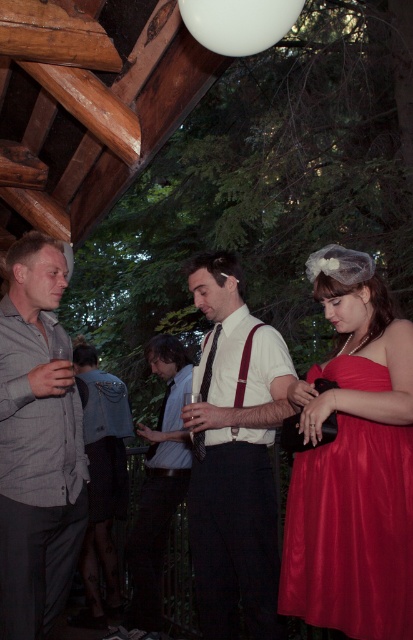
Question: Which of the following is the farthest from the observer?

Choices:
 (A) (11, 573)
 (B) (199, 253)
 (C) (121, 387)

Answer: (C)

Question: Which of the following is the farthest from the observer?

Choices:
 (A) (14, 333)
 (B) (394, 465)
 (C) (90, 625)
 (D) (163, 500)

Answer: (C)

Question: Among these objects, which one is nearest to the camera?

Choices:
 (A) denim jacket at center
 (B) matte red dress at center

Answer: (B)

Question: Is white matte shirt at center closer to the viewer compared to shiny red dress at lower right?

Choices:
 (A) no
 (B) yes

Answer: (A)

Question: Does shiny red dress at lower right lie in front of light blue shirt at center?

Choices:
 (A) no
 (B) yes

Answer: (B)

Question: Can you confirm if matte red dress at center is wider than gray textured shirt at center?

Choices:
 (A) no
 (B) yes

Answer: (B)